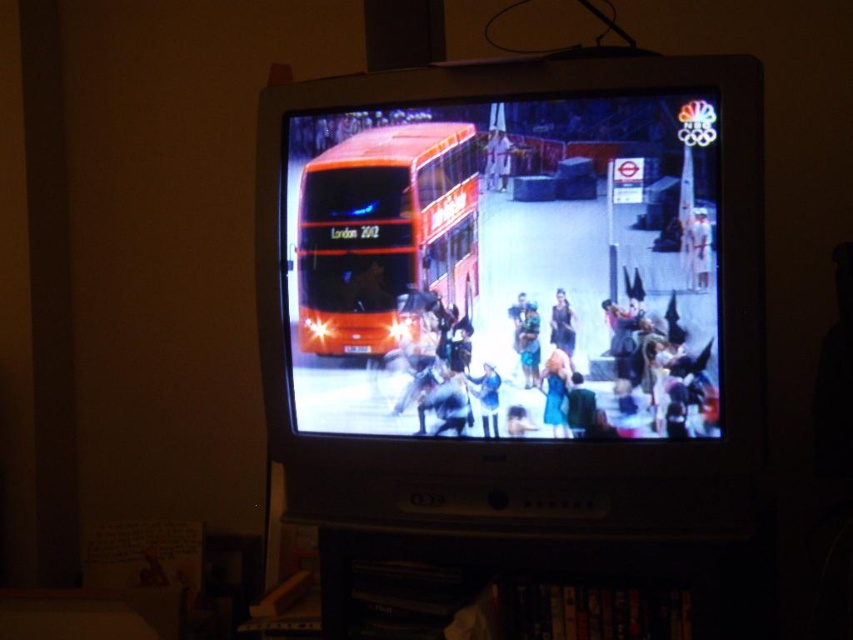
Question: Does metallic silver television at center appear on the right side of matte black dress at center?

Choices:
 (A) no
 (B) yes

Answer: (A)

Question: Which of the following is the farthest from the observer?

Choices:
 (A) (701, 236)
 (B) (605, 417)
 (C) (550, 310)

Answer: (C)

Question: Which point is farther from the camera taking this photo?

Choices:
 (A) (486, 113)
 (B) (556, 328)
 (C) (674, 305)

Answer: (A)

Question: Which of the following is the farthest from the observer?

Choices:
 (A) (300, 323)
 (B) (564, 337)

Answer: (A)

Question: Does metallic silver television at center appear on the right side of shiny orange bus at center?

Choices:
 (A) yes
 (B) no

Answer: (A)

Question: Observing the image, what is the correct spatial positioning of metallic silver television at center in reference to shiny orange bus at center?

Choices:
 (A) below
 (B) above

Answer: (A)